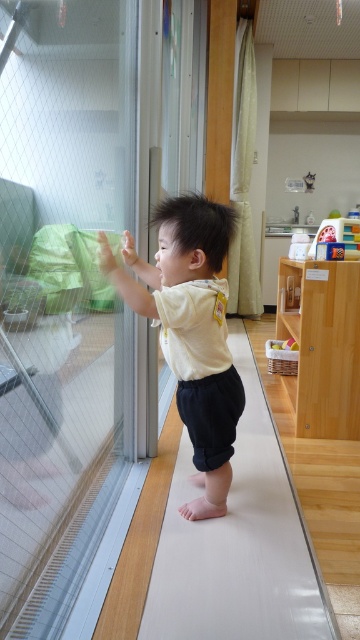
You are a photographer trying to capture the child in the image. You want to ensure that both the point at (74, 445) and the point at (153, 269) are in focus. Which point should you focus on to ensure both are sharp?

You should focus on the point that is further away from the camera, which is point (153, 269). This way, the depth of field will include both points since the closer point (74, 445) will be within the range of sharpness.

You are a parent trying to clean up the play area. You see the white smooth ramp at center and the white cotton shirt at center. Which object should you move first to organize the space, considering their positions?

The white smooth ramp at center is positioned on the right side of the white cotton shirt at center. Since the shirt is likely an item of clothing and the ramp is a toy, you should move the white smooth ramp at center first to its proper storage area before folding the white cotton shirt at center.